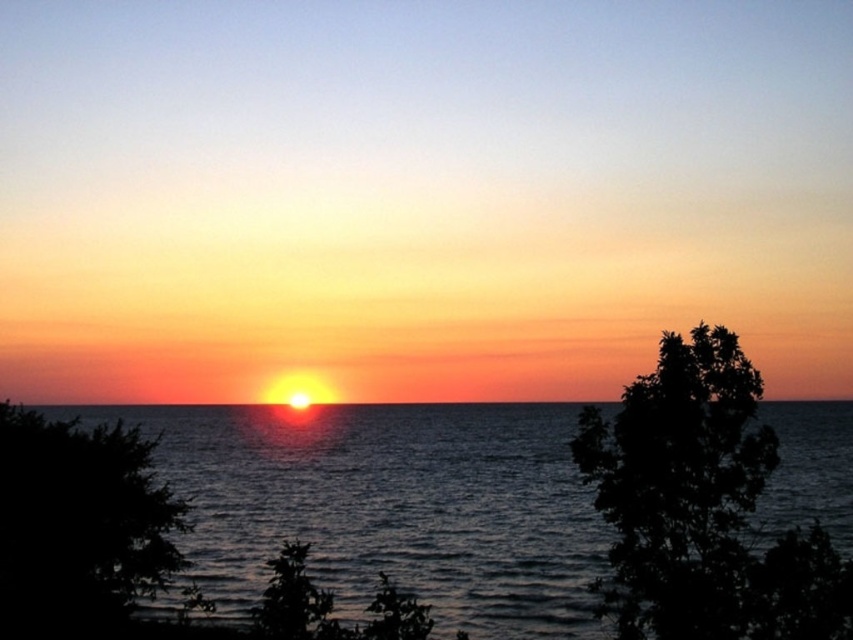
Which is below, silhouette leafy tree at right or dark green leafy tree at lower left?

dark green leafy tree at lower left is below.

Can you confirm if silhouette leafy tree at right is positioned to the right of dark green leafy tree at lower left?

Correct, you'll find silhouette leafy tree at right to the right of dark green leafy tree at lower left.

Which is behind, point (704, 474) or point (65, 620)?

Positioned behind is point (65, 620).

Where is `silhouette leafy tree at right`? The image size is (853, 640). silhouette leafy tree at right is located at coordinates (701, 508).

Does point (548, 636) lie in front of point (119, 420)?

That is False.

Can you confirm if glistening blue water at center is positioned to the right of dark green leafy tree at lower left?

Indeed, glistening blue water at center is positioned on the right side of dark green leafy tree at lower left.

Is point (567, 525) in front of point (12, 502)?

No, it is behind (12, 502).

Where is `glistening blue water at center`? This screenshot has height=640, width=853. glistening blue water at center is located at coordinates (389, 506).

Locate an element on the screen. Image resolution: width=853 pixels, height=640 pixels. glistening blue water at center is located at coordinates (389, 506).